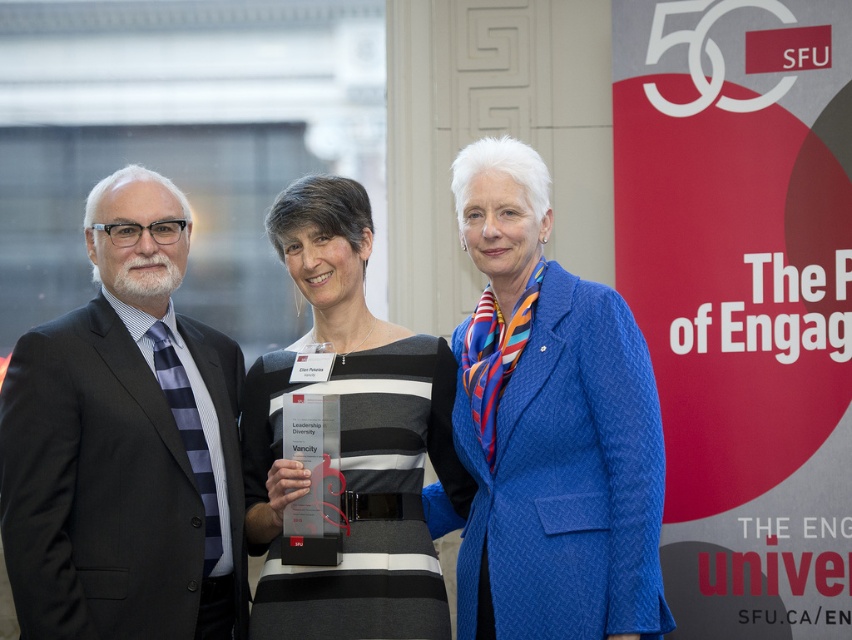
You are standing in the room where the image was taken. You need to find the black suit at left. According to the coordinates provided, where exactly should you look to locate it?

The black suit at left is located at point (125, 444), so you should look at that coordinate to find it.